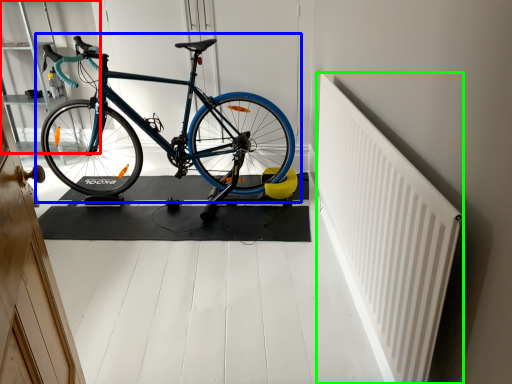
Question: Which is farther away from shelf (highlighted by a red box)? bicycle (highlighted by a blue box) or radiator (highlighted by a green box)?

Choices:
 (A) bicycle
 (B) radiator

Answer: (B)